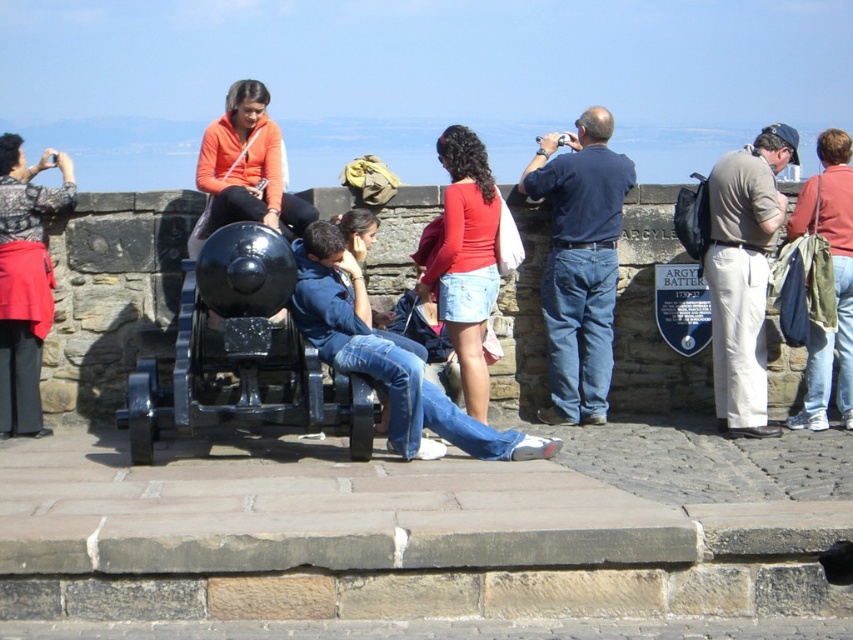
Question: Which of the following is the farthest from the observer?

Choices:
 (A) black polished cannon at center
 (B) denim shorts at center
 (C) denim jeans at right

Answer: (C)

Question: Which of these objects is positioned closest to the black polished cannon at center?

Choices:
 (A) khaki cotton pants at right
 (B) denim shorts at center
 (C) denim jeans at right

Answer: (B)

Question: Which object is farther from the camera taking this photo?

Choices:
 (A) black polished cannon at center
 (B) denim jeans at right
 (C) khaki cotton pants at right

Answer: (B)

Question: Is matte black camera at left bigger than denim shorts at center?

Choices:
 (A) yes
 (B) no

Answer: (A)

Question: Is khaki cotton pants at right to the left of matte black camera at left from the viewer's perspective?

Choices:
 (A) no
 (B) yes

Answer: (A)

Question: Is the position of matte black camera at left more distant than that of denim shorts at center?

Choices:
 (A) yes
 (B) no

Answer: (A)